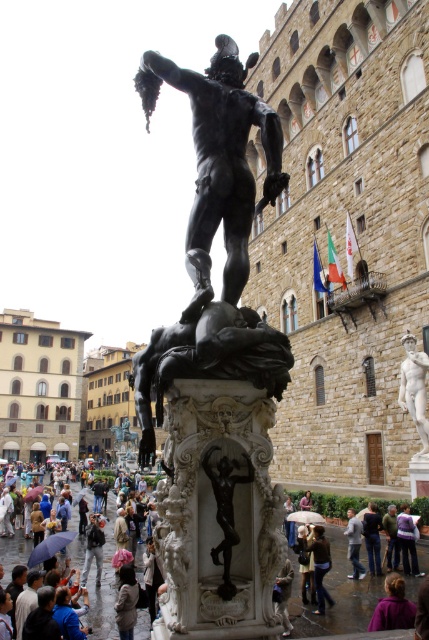
You are standing at the base of the Perseus statue in the square and notice the raincoats umbrellas at lower center and a camera somewhere in the scene. How far apart are these two items from your current position?

The raincoats umbrellas at lower center and camera are 24.71 meters apart from each other.

You are standing in the public square and want to take a photo of the bronze statue at center. If you are currently at the point with coordinates [218,161], which is the location of the bronze statue, can you take a clear photo without any obstructions?

The bronze statue at center is represented by point [218,161], so you are standing right at the statue. To take a clear photo without obstructions, you might need to move back to get a better view.

You are standing in the public square and see two items for sale. One is raincoats umbrellas at lower center and the other is brown leather jacket at center. Which item is positioned to the left of the other?

raincoats umbrellas at lower center is to the left of brown leather jacket at center.